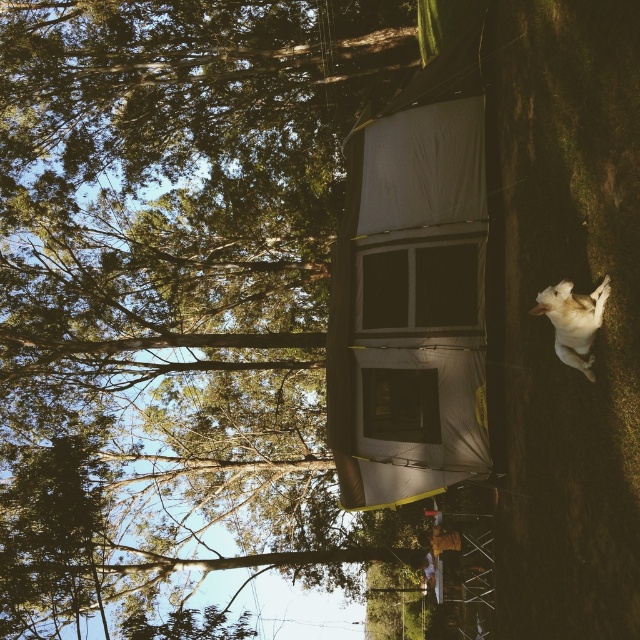
Question: Does transparent plastic window at center have a lesser width compared to white fur dog at lower right?

Choices:
 (A) no
 (B) yes

Answer: (A)

Question: Which of these objects is positioned closest to the green leafy tree at upper center?

Choices:
 (A) white fur dog at lower right
 (B) transparent fabric window at center
 (C) transparent plastic window at center

Answer: (C)

Question: Is the position of green leafy tree at upper center less distant than that of white fur dog at lower right?

Choices:
 (A) no
 (B) yes

Answer: (A)

Question: Which of the following is the farthest from the observer?

Choices:
 (A) white fur dog at lower right
 (B) transparent fabric window at center

Answer: (B)

Question: Which object is the farthest from the green leafy tree at upper center?

Choices:
 (A) transparent fabric window at center
 (B) transparent plastic window at center
 (C) white fur dog at lower right

Answer: (C)

Question: Is green leafy tree at upper center positioned at the back of white fur dog at lower right?

Choices:
 (A) yes
 (B) no

Answer: (A)